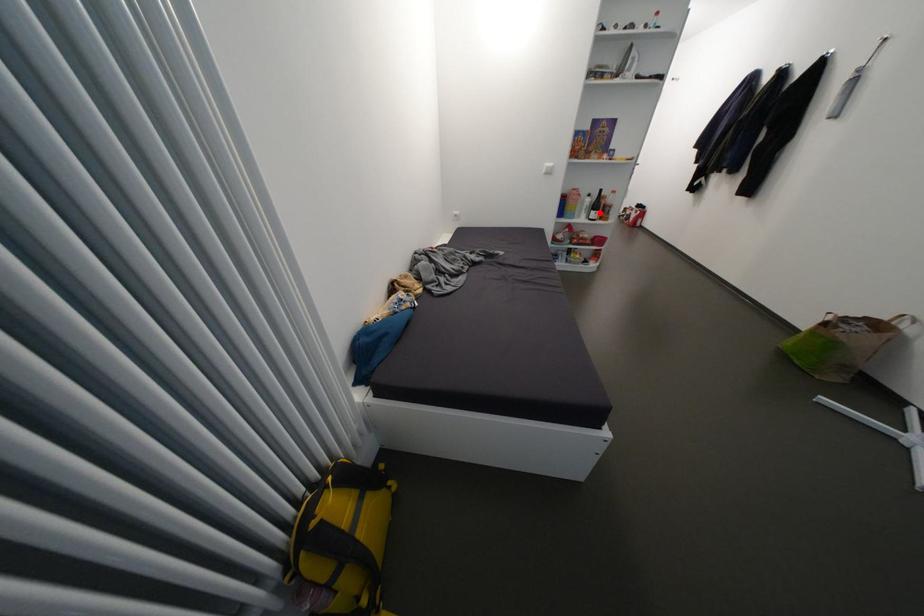
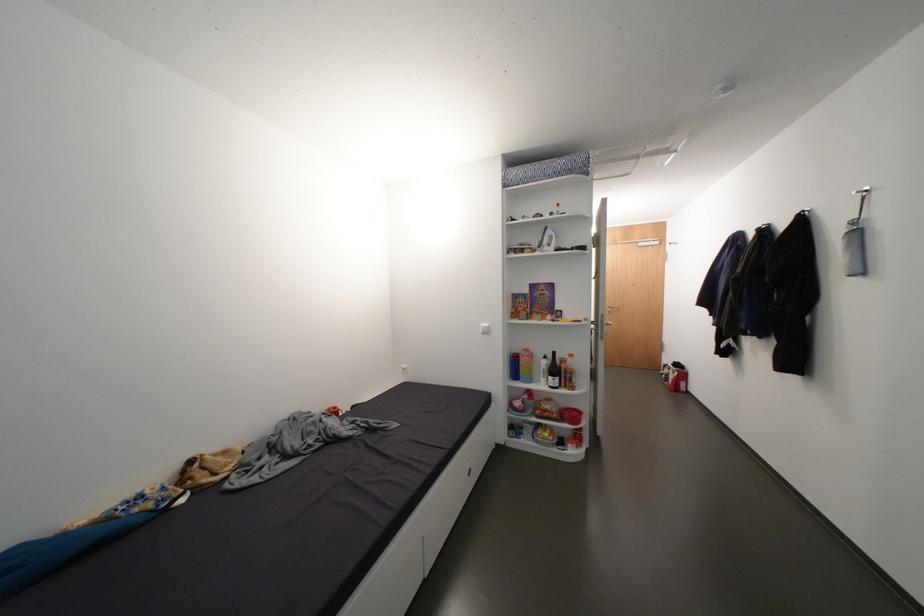
Question: A red point is marked in image1. In image2, is the corresponding 3D point closer to the camera or farther? Reply with the corresponding letter.

Choices:
 (A) The corresponding 3D point is closer.
 (B) The corresponding 3D point is farther.

Answer: (B)